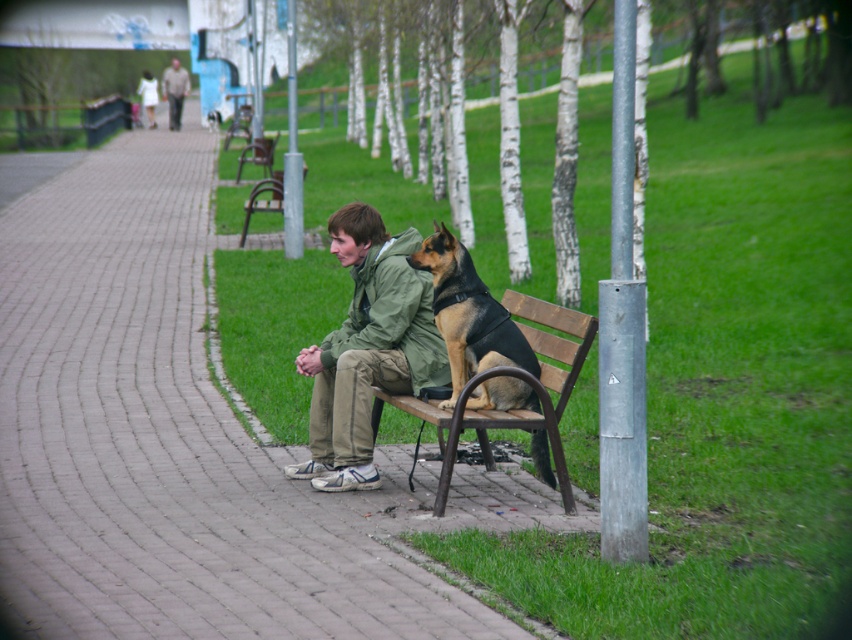
Is black leather dog at center above metallic brown bench at center?

No, black leather dog at center is not above metallic brown bench at center.

Which is in front, point (508, 380) or point (271, 195)?

Point (508, 380) is in front.

The width and height of the screenshot is (852, 640). I want to click on black leather dog at center, so click(468, 314).

How distant is green matte jacket at center from brown wooden bench at center?

green matte jacket at center is 24.68 meters away from brown wooden bench at center.

Who is more forward, (x=407, y=237) or (x=268, y=144)?

Point (x=407, y=237) is more forward.

Locate an element on the screen. green matte jacket at center is located at coordinates (367, 348).

Can you confirm if metallic brown bench at center is shorter than camouflage fabric jacket at upper center?

Indeed, metallic brown bench at center has a lesser height compared to camouflage fabric jacket at upper center.

Is the position of metallic brown bench at center more distant than that of camouflage fabric jacket at upper center?

No, metallic brown bench at center is in front of camouflage fabric jacket at upper center.

This screenshot has width=852, height=640. I want to click on metallic brown bench at center, so click(x=263, y=198).